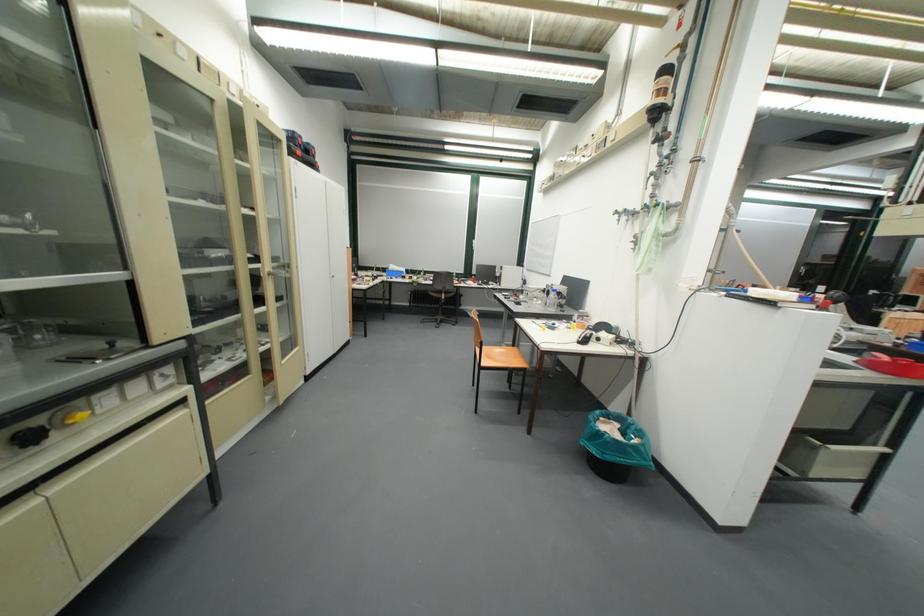
Identify the location of black trash can. The width and height of the screenshot is (924, 616). (614, 445).